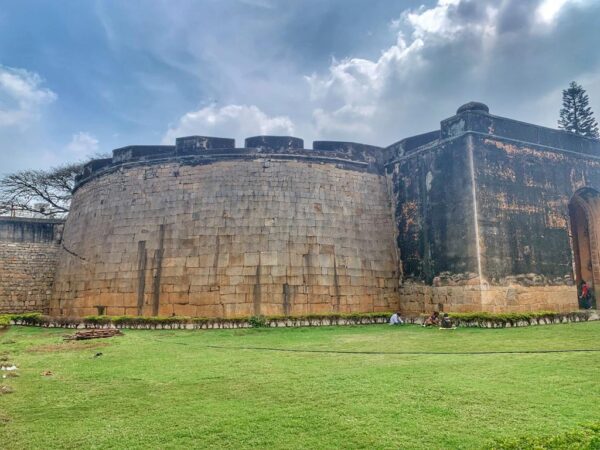
Locate an element on the screen. The height and width of the screenshot is (450, 600). wall is located at coordinates (201, 261), (35, 260), (458, 208).